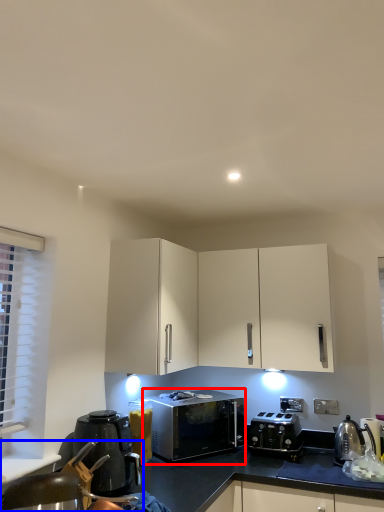
Question: Which object appears farthest to the camera in this image, microwave oven (highlighted by a red box) or swivel chair (highlighted by a blue box)?

Choices:
 (A) microwave oven
 (B) swivel chair

Answer: (A)